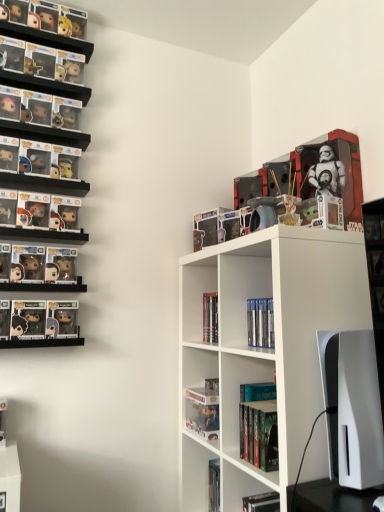
Question: Can you confirm if clear plastic figure at lower center, which is counted as the fourth book, starting from the top, is positioned to the left of clear plastic book at upper center, which is the 1th book in top-to-bottom order?

Choices:
 (A) yes
 (B) no

Answer: (A)

Question: From a real-world perspective, does clear plastic figure at lower center, which is counted as the fourth book, starting from the top, stand above clear plastic book at upper center, which is the fifth book in bottom-to-top order?

Choices:
 (A) yes
 (B) no

Answer: (B)

Question: Is clear plastic figure at lower center, arranged as the second book when ordered from the bottom, looking in the opposite direction of clear plastic book at upper center, which is the 1th book in top-to-bottom order?

Choices:
 (A) yes
 (B) no

Answer: (B)

Question: From the image's perspective, is clear plastic figure at lower center, which is counted as the fourth book, starting from the top, located beneath clear plastic book at upper center, which is the 1th book in top-to-bottom order?

Choices:
 (A) yes
 (B) no

Answer: (A)

Question: Is clear plastic figure at lower center, which is counted as the fourth book, starting from the top, smaller than clear plastic book at upper center, which is the 1th book in top-to-bottom order?

Choices:
 (A) yes
 (B) no

Answer: (A)

Question: Does point (240, 224) appear closer or farther from the camera than point (271, 297)?

Choices:
 (A) closer
 (B) farther

Answer: (B)

Question: Is clear plastic book at upper center, which is the fifth book in bottom-to-top order, inside the boundaries of hardcover book at center, arranged as the 2th book when viewed from the top, or outside?

Choices:
 (A) inside
 (B) outside

Answer: (B)

Question: Looking at their shapes, would you say clear plastic book at upper center, which is the fifth book in bottom-to-top order, is wider or thinner than hardcover book at center, arranged as the 2th book when viewed from the top?

Choices:
 (A) wide
 (B) thin

Answer: (A)

Question: In the image, is clear plastic book at upper center, which is the 1th book in top-to-bottom order, positioned in front of or behind hardcover book at center, arranged as the 2th book when viewed from the top?

Choices:
 (A) front
 (B) behind

Answer: (B)

Question: Is hardcover book at center, which is the 4th book from bottom to top, inside the boundaries of clear plastic figure at lower center, arranged as the second book when ordered from the bottom, or outside?

Choices:
 (A) inside
 (B) outside

Answer: (B)

Question: Considering the positions of hardcover book at center, which is the 4th book from bottom to top, and clear plastic figure at lower center, which is counted as the fourth book, starting from the top, in the image, is hardcover book at center, which is the 4th book from bottom to top, taller or shorter than clear plastic figure at lower center, which is counted as the fourth book, starting from the top,?

Choices:
 (A) short
 (B) tall

Answer: (B)

Question: Is point (258, 307) closer or farther from the camera than point (190, 391)?

Choices:
 (A) closer
 (B) farther

Answer: (A)

Question: Is hardcover book at center, which is the 4th book from bottom to top, in front of or behind clear plastic figure at lower center, arranged as the second book when ordered from the bottom, in the image?

Choices:
 (A) behind
 (B) front

Answer: (B)

Question: Would you say clear plastic figure at lower center, which is counted as the fourth book, starting from the top, is inside or outside clear plastic book at upper center, which is the fifth book in bottom-to-top order?

Choices:
 (A) inside
 (B) outside

Answer: (B)

Question: From the image's perspective, is clear plastic figure at lower center, which is counted as the fourth book, starting from the top, positioned above or below clear plastic book at upper center, which is the 1th book in top-to-bottom order?

Choices:
 (A) above
 (B) below

Answer: (B)